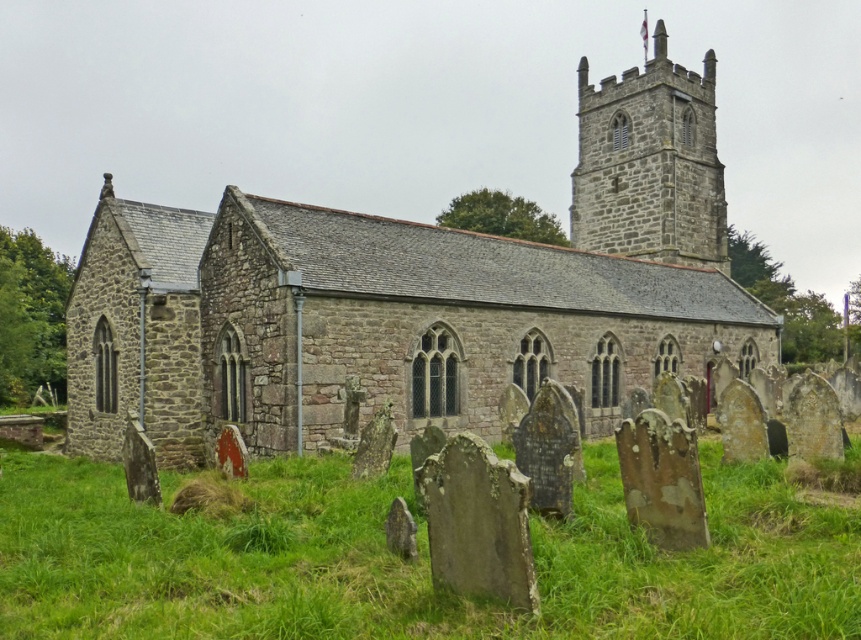
Question: Which point is farther from the camera taking this photo?

Choices:
 (A) (612, 100)
 (B) (0, 525)

Answer: (A)

Question: Is stone church at center above green mossy grass at lower center?

Choices:
 (A) no
 (B) yes

Answer: (B)

Question: Which point is farther from the camera taking this photo?

Choices:
 (A) (175, 534)
 (B) (485, 307)

Answer: (B)

Question: Which object is positioned farthest from the gray stone tower at upper center?

Choices:
 (A) green mossy grass at lower center
 (B) stone church at center

Answer: (A)

Question: In this image, where is green mossy grass at lower center located relative to gray stone tower at upper center?

Choices:
 (A) above
 (B) below

Answer: (B)

Question: Is stone church at center further to the viewer compared to green mossy grass at lower center?

Choices:
 (A) yes
 (B) no

Answer: (A)